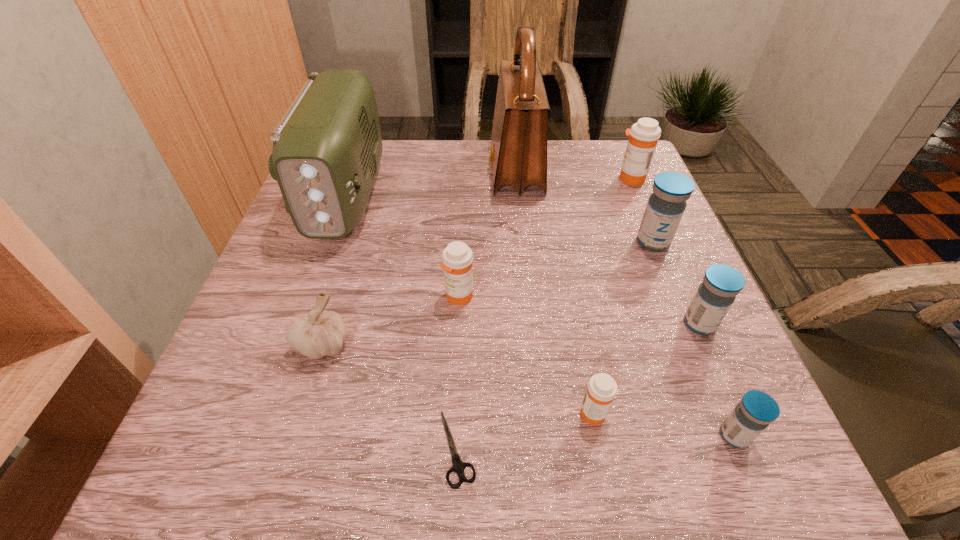
At what (x,y) coordinates should I click in order to perform the action: click on vacant space at the far right corner. Please return your answer as a coordinate pair (x, y). The width and height of the screenshot is (960, 540). Looking at the image, I should click on (585, 165).

At what (x,y) coordinates should I click in order to perform the action: click on free spot between the rightmost orange medicine and the leftmost orange medicine. Please return your answer as a coordinate pair (x, y). This screenshot has width=960, height=540. Looking at the image, I should click on pyautogui.click(x=544, y=238).

Find the location of a particular element. The height and width of the screenshot is (540, 960). vacant area that lies between the garlic and the black shears is located at coordinates (390, 396).

Where is `free spot between the second nearest blue medicine and the shoulder bag`? The image size is (960, 540). free spot between the second nearest blue medicine and the shoulder bag is located at coordinates (608, 247).

The width and height of the screenshot is (960, 540). I want to click on vacant area between the sixth nearest object and the nearest orange medicine, so click(x=526, y=355).

Locate an element on the screen. The height and width of the screenshot is (540, 960). free spot between the second medicine from left to right and the shoulder bag is located at coordinates (555, 291).

You are a GUI agent. You are given a task and a screenshot of the screen. Output one action in this format:
    pyautogui.click(x=<x>, y=<y>)
    Task: Click on the unoccupied area between the fifth medicine from right to left and the radio_receiver
    Image resolution: width=960 pixels, height=540 pixels.
    Given the screenshot: What is the action you would take?
    pyautogui.click(x=470, y=303)

Image resolution: width=960 pixels, height=540 pixels. What are the coordinates of `vacant area that lies between the nearest blue medicine and the garlic` in the screenshot? It's located at (528, 390).

Find the location of a particular element. The image size is (960, 540). empty location between the smallest blue medicine and the nearest orange medicine is located at coordinates (664, 424).

Find the location of a particular element. The height and width of the screenshot is (540, 960). free area in between the tallest object and the third nearest medicine is located at coordinates (608, 247).